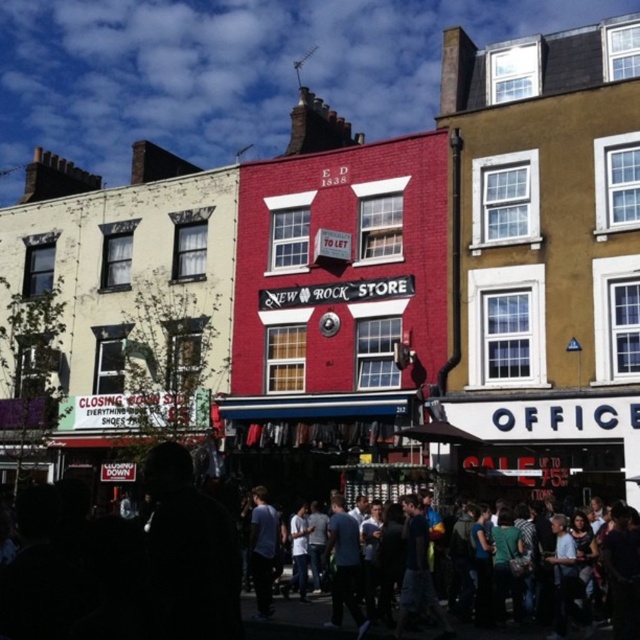
Question: Which point is farther to the camera?

Choices:
 (A) (147, 477)
 (B) (259, 518)

Answer: (B)

Question: Is dark clothing crowd at center to the right of light blue jeans at center from the viewer's perspective?

Choices:
 (A) no
 (B) yes

Answer: (B)

Question: Which object appears farthest from the camera in this image?

Choices:
 (A) light blue jeans at center
 (B) dark clothing crowd at center

Answer: (A)

Question: Which of the following is the closest to the observer?

Choices:
 (A) (224, 602)
 (B) (268, 524)

Answer: (A)

Question: Does dark clothing crowd at center have a lesser width compared to light blue jeans at center?

Choices:
 (A) yes
 (B) no

Answer: (B)

Question: Is dark clothing crowd at center to the right of light blue jeans at center from the viewer's perspective?

Choices:
 (A) yes
 (B) no

Answer: (A)